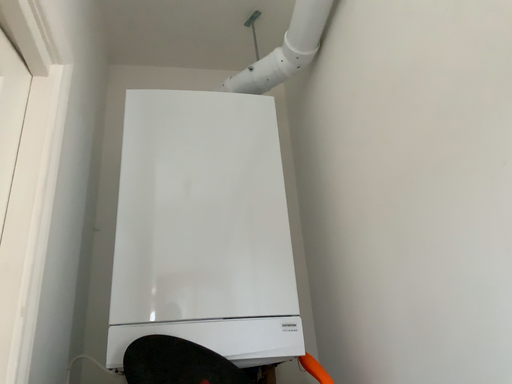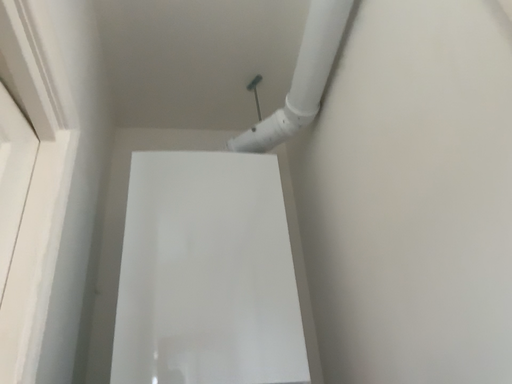
Question: How did the camera likely rotate when shooting the video?

Choices:
 (A) rotated downward
 (B) rotated upward

Answer: (B)